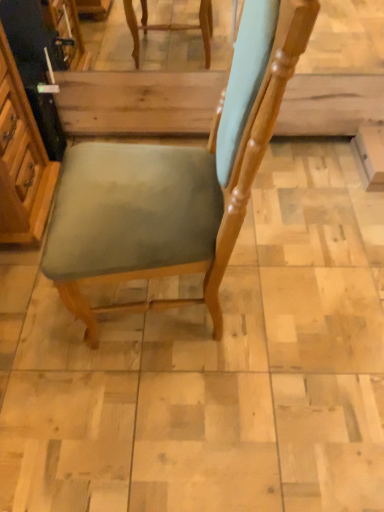
Based on the photo, what is the approximate height of matte green fabric chair at center?

matte green fabric chair at center is 3.38 feet tall.

What is the approximate width of matte green fabric chair at center?

matte green fabric chair at center is 56.90 centimeters wide.

What do you see at coordinates (175, 182) in the screenshot? Image resolution: width=384 pixels, height=512 pixels. I see `matte green fabric chair at center` at bounding box center [175, 182].

At what (x,y) coordinates should I click in order to perform the action: click on matte green fabric chair at center. Please return your answer as a coordinate pair (x, y). The image size is (384, 512). Looking at the image, I should click on (175, 182).

This screenshot has width=384, height=512. What are the coordinates of `matte green fabric chair at center` in the screenshot? It's located at (175, 182).